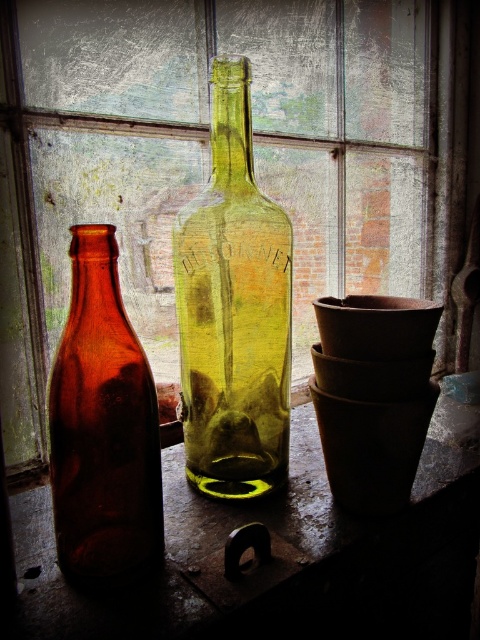
Question: Among these objects, which one is nearest to the camera?

Choices:
 (A) amber glass bottle at center
 (B) transparent glass window at center

Answer: (A)

Question: Is green glass bottle at center smaller than matte brown pot at right?

Choices:
 (A) no
 (B) yes

Answer: (A)

Question: Considering the real-world distances, which object is closest to the transparent glass window at center?

Choices:
 (A) amber glass bottle at left
 (B) green glass bottle at center
 (C) amber glass bottle at center

Answer: (B)

Question: Considering the relative positions of amber glass bottle at center and matte brown pot at right in the image provided, where is amber glass bottle at center located with respect to matte brown pot at right?

Choices:
 (A) above
 (B) below

Answer: (A)

Question: Is green glass bottle at center further to the viewer compared to matte brown pot at right?

Choices:
 (A) yes
 (B) no

Answer: (B)

Question: Which object is the farthest from the transparent glass window at center?

Choices:
 (A) matte brown pot at right
 (B) amber glass bottle at center

Answer: (A)